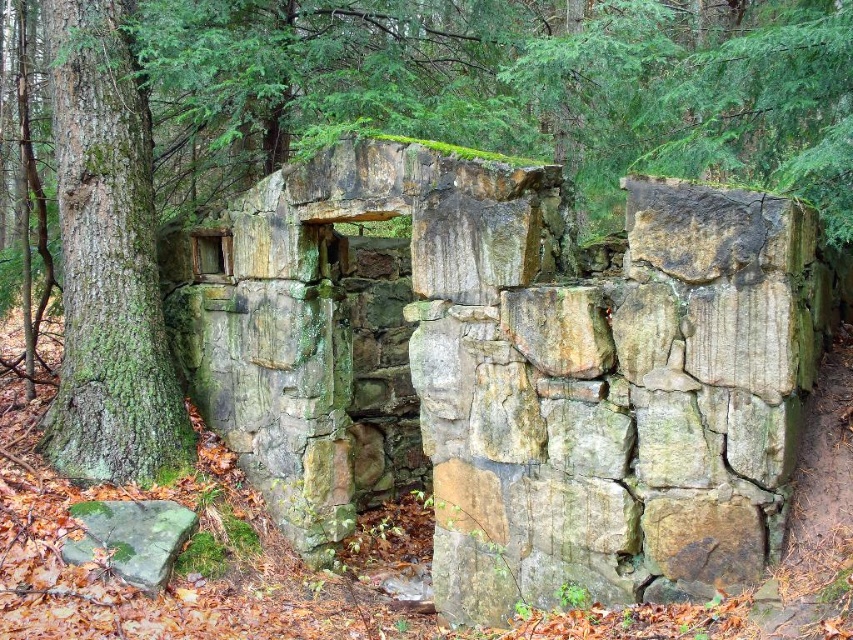
What do you see at coordinates (509, 369) in the screenshot? I see `green mossy stone wall at center` at bounding box center [509, 369].

Is green mossy stone wall at center positioned in front of green mossy rock at lower left?

Yes.

Who is more distant from viewer, (335, 237) or (88, 508)?

Positioned behind is point (335, 237).

Image resolution: width=853 pixels, height=640 pixels. Find the location of `green mossy stone wall at center`. green mossy stone wall at center is located at coordinates (509, 369).

Who is more distant from viewer, [109,157] or [148,520]?

Positioned behind is point [109,157].

Where is `green mossy bark tree at left`? This screenshot has height=640, width=853. green mossy bark tree at left is located at coordinates (108, 260).

Who is positioned more to the left, green mossy stone wall at center or green mossy bark tree at left?

Positioned to the left is green mossy bark tree at left.

Who is taller, green mossy stone wall at center or green mossy bark tree at left?

green mossy bark tree at left is taller.

Between point (358, 176) and point (85, 80), which one is positioned in front?

Positioned in front is point (358, 176).

Locate an element on the screen. This screenshot has height=640, width=853. green mossy stone wall at center is located at coordinates coord(509,369).